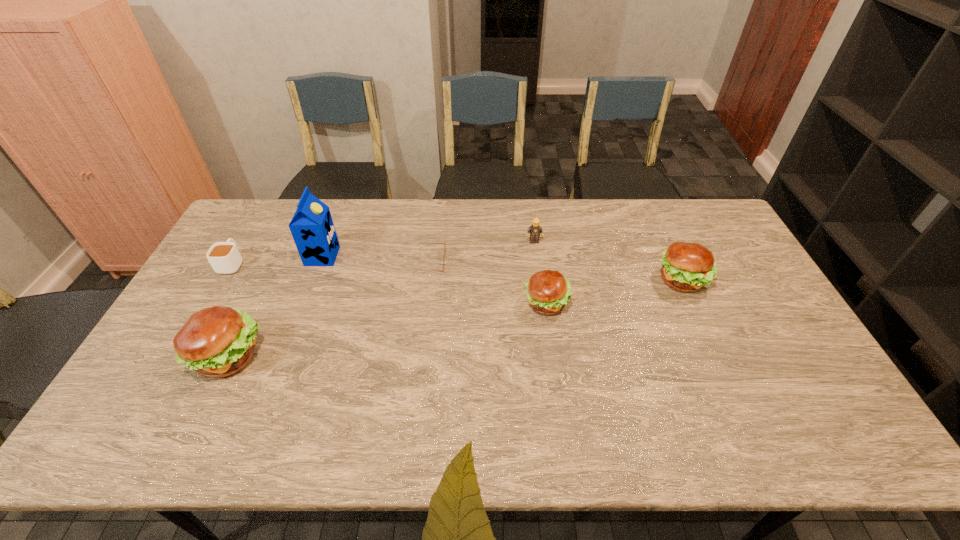
Find the location of a particular element. This screenshot has width=960, height=540. free spot at the right edge of the desktop is located at coordinates (765, 372).

In the image, there is a desktop. Identify the location of free space at the near left corner. The width and height of the screenshot is (960, 540). (192, 392).

At what (x,y) coordinates should I click in order to perform the action: click on vacant space at the far right corner of the desktop. Please return your answer as a coordinate pair (x, y). The height and width of the screenshot is (540, 960). Looking at the image, I should click on (692, 211).

Image resolution: width=960 pixels, height=540 pixels. In order to click on free spot between the nearest hamburger and the rightmost object in this screenshot , I will do `click(456, 318)`.

Where is `unoccupied position between the shortest hamburger and the fourth object from left to right`? This screenshot has width=960, height=540. unoccupied position between the shortest hamburger and the fourth object from left to right is located at coordinates 489,282.

This screenshot has width=960, height=540. I want to click on free area in between the second hamburger from left to right and the second object from left to right, so click(388, 329).

Where is `free space between the shortest object and the leftmost hamburger`? This screenshot has height=540, width=960. free space between the shortest object and the leftmost hamburger is located at coordinates (329, 308).

Identify the location of free space between the sixth tallest object and the carton. The width and height of the screenshot is (960, 540). (277, 260).

This screenshot has width=960, height=540. Find the location of `vacant region between the fourth object from left to right and the Lego`. vacant region between the fourth object from left to right and the Lego is located at coordinates (482, 251).

You are a GUI agent. You are given a task and a screenshot of the screen. Output one action in this format:
    pyautogui.click(x=<x>, y=<y>)
    Task: Click on the free space between the shortest hamburger and the tallest object
    The height and width of the screenshot is (540, 960).
    Given the screenshot: What is the action you would take?
    pyautogui.click(x=435, y=280)